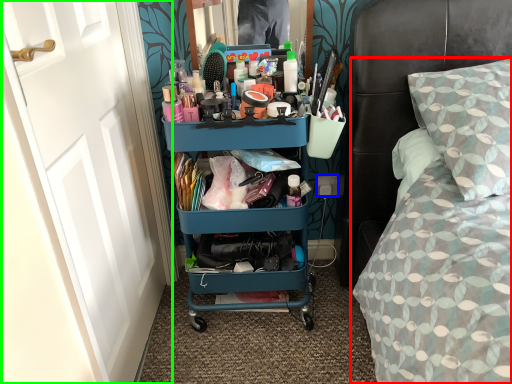
Question: Which object is positioned closest to bed (highlighted by a red box)? Select from power outlet (highlighted by a blue box) and door (highlighted by a green box).

Choices:
 (A) power outlet
 (B) door

Answer: (A)